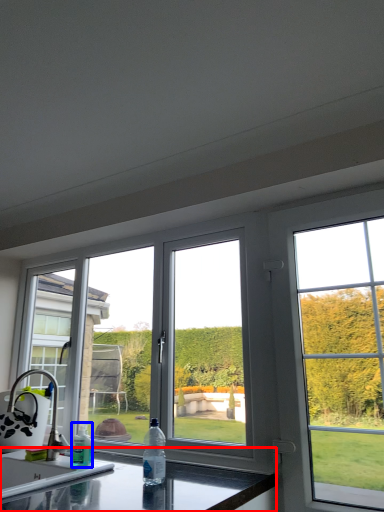
Question: Which object is closer to the camera taking this photo, countertop (highlighted by a red box) or bottle (highlighted by a blue box)?

Choices:
 (A) countertop
 (B) bottle

Answer: (A)